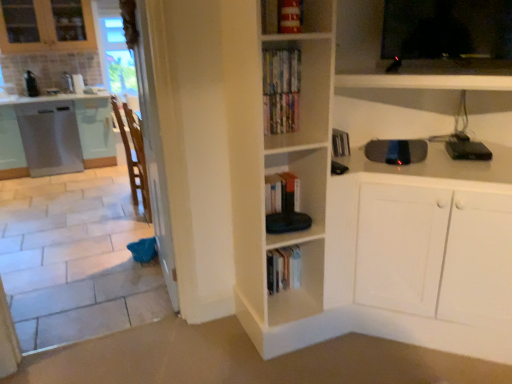
Identify the location of vacant space that is to the left of brown wooden chair at left. The height and width of the screenshot is (384, 512). 111,218.